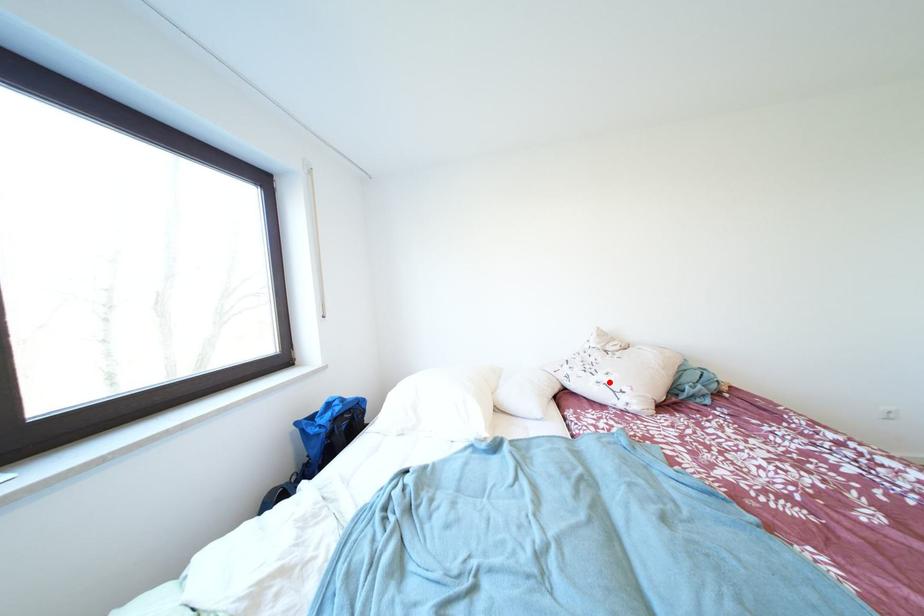
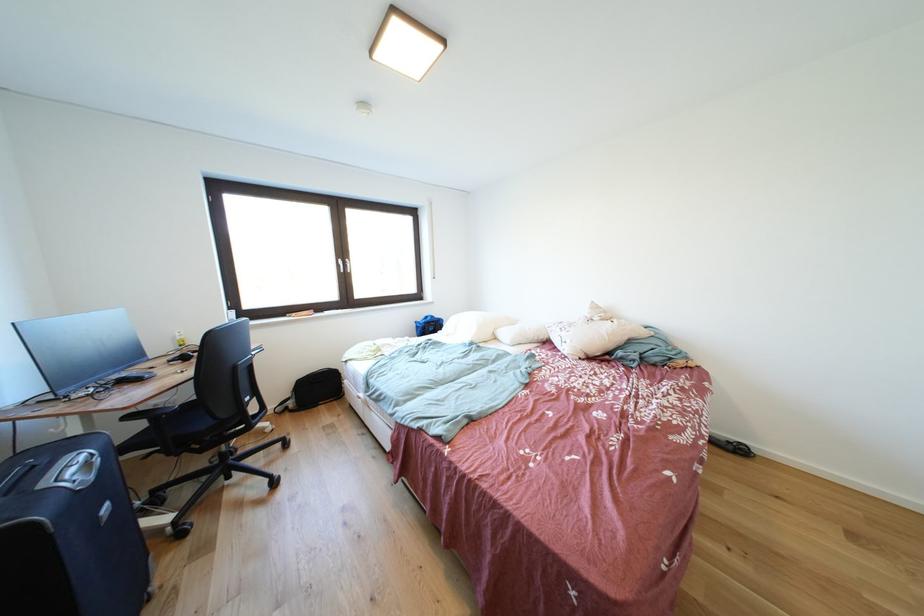
The point at the highlighted location is marked in the first image. Where is the corresponding point in the second image?

(572, 338)